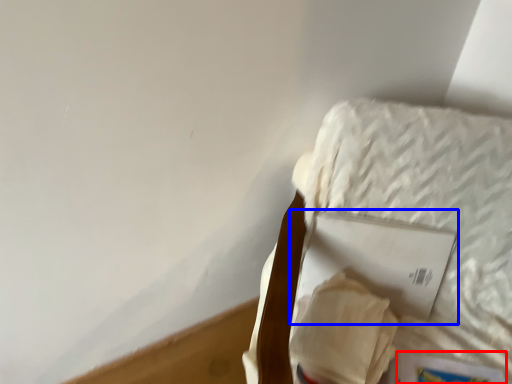
Question: Which object appears closest to the camera in this image, paperback book (highlighted by a red box) or paperback book (highlighted by a blue box)?

Choices:
 (A) paperback book
 (B) paperback book

Answer: (A)